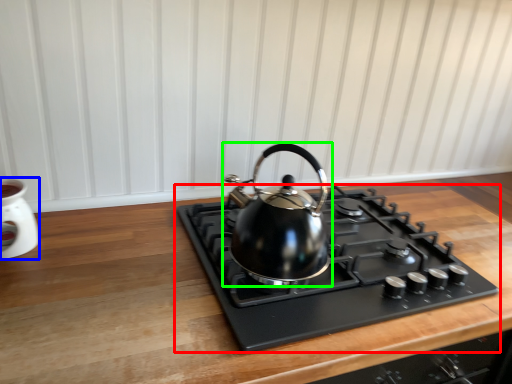
Question: Based on their relative distances, which object is nearer to gas stove (highlighted by a red box)? Choose from appliance (highlighted by a blue box) and kettle (highlighted by a green box).

Choices:
 (A) appliance
 (B) kettle

Answer: (B)